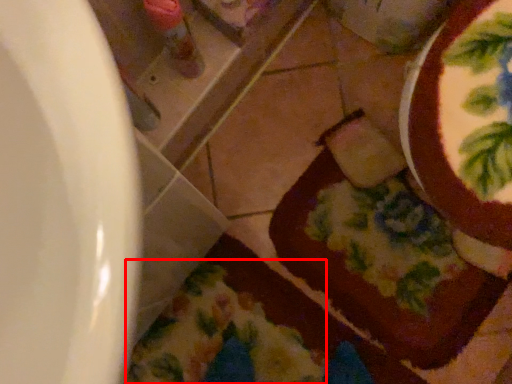
Question: From the image's perspective, considering the relative positions of blanket (annotated by the red box) and chocolate cake in the image provided, where is blanket (annotated by the red box) located with respect to the staircase?

Choices:
 (A) below
 (B) above

Answer: (A)